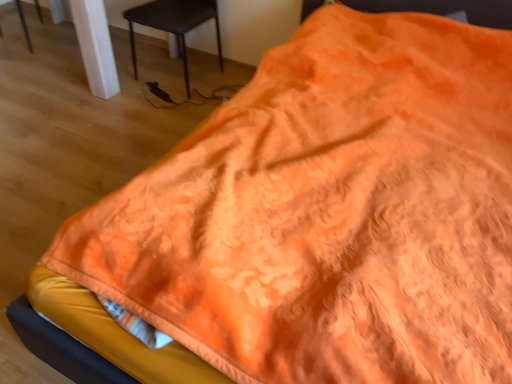
Question: Is black plastic chair at lower left, the 2th chair viewed from the left, bigger than matte white chair at upper left, which is counted as the 2th chair, starting from the right?

Choices:
 (A) no
 (B) yes

Answer: (B)

Question: Is black plastic chair at lower left, the 2th chair viewed from the left, taller than matte white chair at upper left, which is counted as the 2th chair, starting from the right?

Choices:
 (A) no
 (B) yes

Answer: (B)

Question: From a real-world perspective, is black plastic chair at lower left, the 1th chair positioned from the right, located beneath matte white chair at upper left, which is counted as the 2th chair, starting from the right?

Choices:
 (A) yes
 (B) no

Answer: (B)

Question: From the image's perspective, is black plastic chair at lower left, the 1th chair positioned from the right, below matte white chair at upper left, which is counted as the 2th chair, starting from the right?

Choices:
 (A) no
 (B) yes

Answer: (B)

Question: Considering the relative sizes of black plastic chair at lower left, the 1th chair positioned from the right, and matte white chair at upper left, the 1th chair viewed from the left, in the image provided, is black plastic chair at lower left, the 1th chair positioned from the right, wider than matte white chair at upper left, the 1th chair viewed from the left,?

Choices:
 (A) yes
 (B) no

Answer: (A)

Question: Is black plastic chair at lower left, the 2th chair viewed from the left, facing away from matte white chair at upper left, which is counted as the 2th chair, starting from the right?

Choices:
 (A) no
 (B) yes

Answer: (A)

Question: Is black plastic chair at lower left, the 2th chair viewed from the left, at the back of matte white chair at upper left, which is counted as the 2th chair, starting from the right?

Choices:
 (A) yes
 (B) no

Answer: (B)

Question: From the image's perspective, is matte white chair at upper left, which is counted as the 2th chair, starting from the right, above black plastic chair at lower left, the 1th chair positioned from the right?

Choices:
 (A) yes
 (B) no

Answer: (A)

Question: Can you confirm if matte white chair at upper left, the 1th chair viewed from the left, is shorter than black plastic chair at lower left, the 2th chair viewed from the left?

Choices:
 (A) no
 (B) yes

Answer: (B)

Question: Considering the relative sizes of matte white chair at upper left, the 1th chair viewed from the left, and black plastic chair at lower left, the 2th chair viewed from the left, in the image provided, is matte white chair at upper left, the 1th chair viewed from the left, wider than black plastic chair at lower left, the 2th chair viewed from the left,?

Choices:
 (A) no
 (B) yes

Answer: (A)

Question: Is matte white chair at upper left, the 1th chair viewed from the left, facing towards black plastic chair at lower left, the 2th chair viewed from the left?

Choices:
 (A) no
 (B) yes

Answer: (B)

Question: Is matte white chair at upper left, the 1th chair viewed from the left, taller than black plastic chair at lower left, the 1th chair positioned from the right?

Choices:
 (A) no
 (B) yes

Answer: (A)

Question: From a real-world perspective, is matte white chair at upper left, which is counted as the 2th chair, starting from the right, above or below black plastic chair at lower left, the 1th chair positioned from the right?

Choices:
 (A) below
 (B) above

Answer: (A)